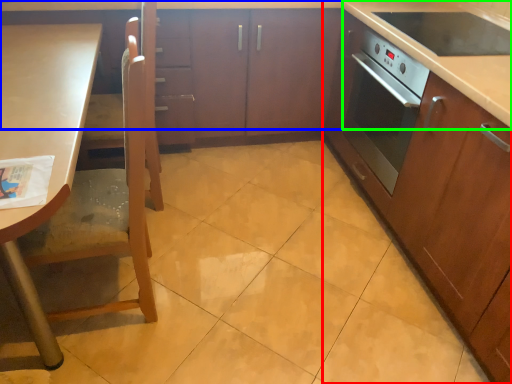
Question: Based on their relative distances, which object is nearer to cabinetry (highlighted by a red box)? Choose from cabinetry (highlighted by a blue box) and counter top (highlighted by a green box).

Choices:
 (A) cabinetry
 (B) counter top

Answer: (B)